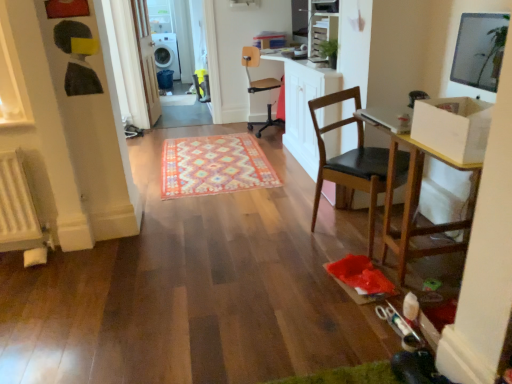
I want to click on free location in front of white matte radiator at lower left, so click(19, 271).